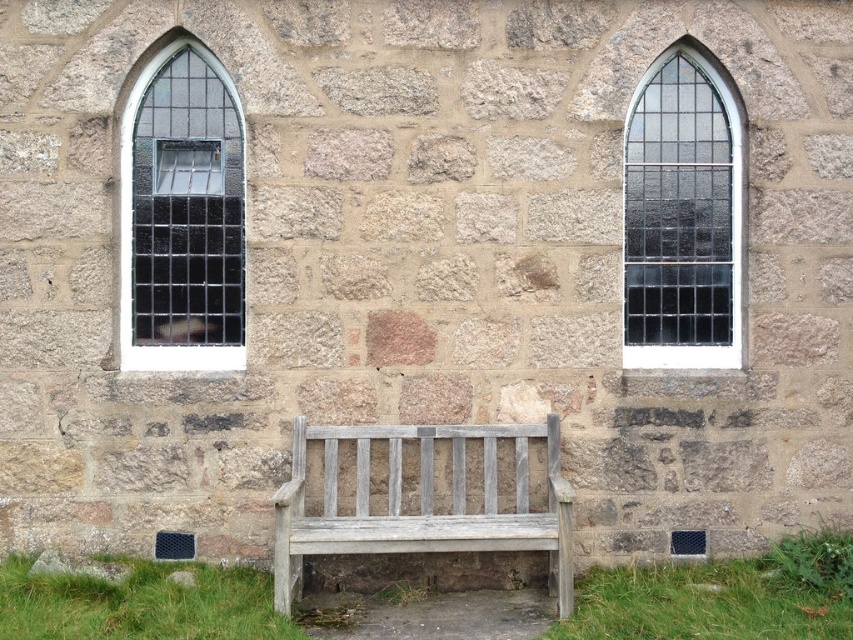
Can you confirm if dark glass window at left is positioned to the left of weathered wood bench at center?

Indeed, dark glass window at left is positioned on the left side of weathered wood bench at center.

Looking at this image, between dark glass window at left and weathered wood bench at center, which one has less height?

weathered wood bench at center is shorter.

Does point (189, 208) come behind point (421, 538)?

Yes, it is behind point (421, 538).

In order to click on dark glass window at left in this screenshot , I will do `click(183, 216)`.

Between point (677, 570) and point (173, 588), which one is positioned in front?

Positioned in front is point (173, 588).

Which of these two, green grass at lower center or green grass at lower left, stands shorter?

green grass at lower center is shorter.

Between point (688, 634) and point (80, 625), which one is positioned behind?

The point (80, 625) is behind.

Identify the location of green grass at lower center. (704, 604).

The width and height of the screenshot is (853, 640). Describe the element at coordinates (682, 218) in the screenshot. I see `clear glass window at center right` at that location.

Measure the distance from clear glass window at center right to green grass at lower left.

clear glass window at center right and green grass at lower left are 7.53 feet apart from each other.

Is point (723, 205) farther from camera compared to point (102, 593)?

Yes, it is behind point (102, 593).

Locate an element on the screen. clear glass window at center right is located at coordinates (682, 218).